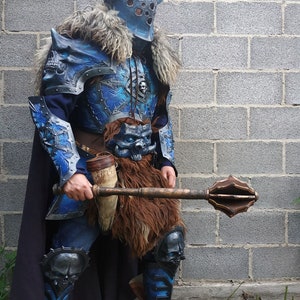
The height and width of the screenshot is (300, 300). I want to click on fur pelt, so click(x=140, y=175).